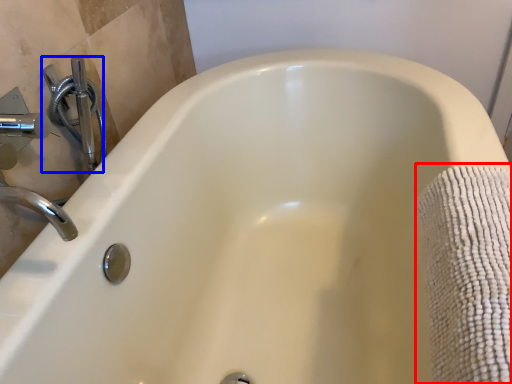
Question: Which object appears farthest to the camera in this image, bath towel (highlighted by a red box) or plumbing fixture (highlighted by a blue box)?

Choices:
 (A) bath towel
 (B) plumbing fixture

Answer: (B)